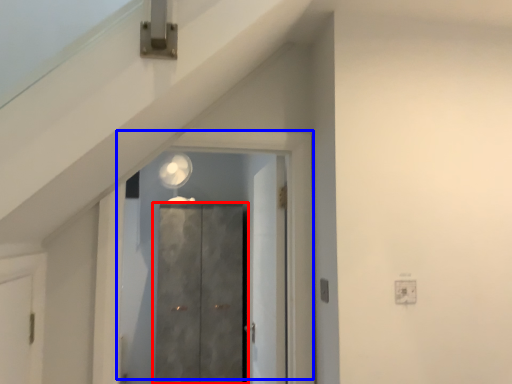
Question: Among these objects, which one is nearest to the camera, door (highlighted by a red box) or door (highlighted by a blue box)?

Choices:
 (A) door
 (B) door

Answer: (B)